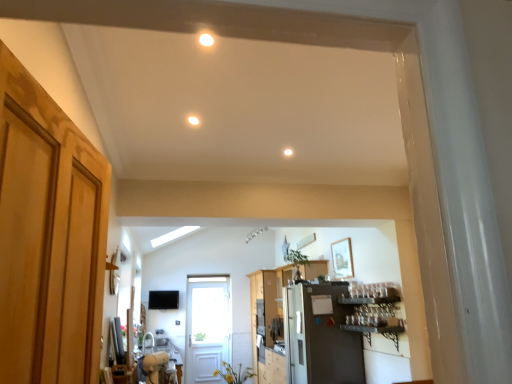
Where is `free point behind white matte light fixture at center, arranged as the 1th lighting when viewed from the right`? The width and height of the screenshot is (512, 384). free point behind white matte light fixture at center, arranged as the 1th lighting when viewed from the right is located at coordinates (288, 158).